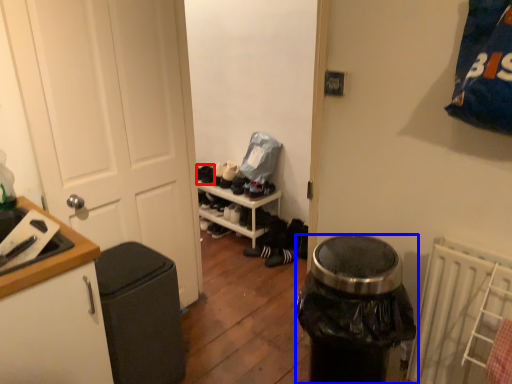
Question: Which of the following is the farthest to the observer, shoe (highlighted by a red box) or trash bin/can (highlighted by a blue box)?

Choices:
 (A) shoe
 (B) trash bin/can

Answer: (A)